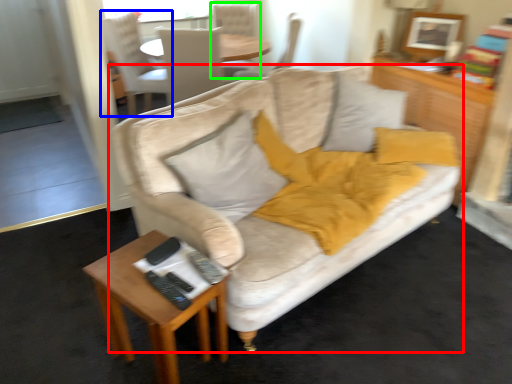
Question: Estimate the real-world distances between objects in this image. Which object is farther from studio couch (highlighted by a red box), chair (highlighted by a blue box) or chair (highlighted by a green box)?

Choices:
 (A) chair
 (B) chair

Answer: (B)